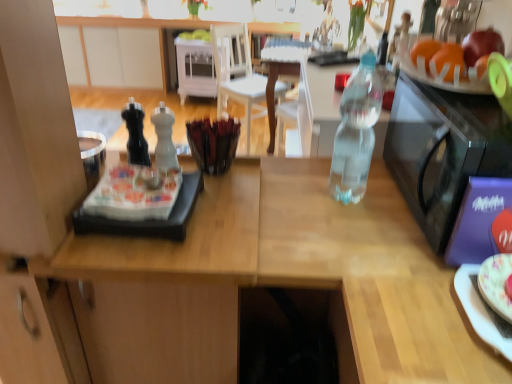
Locate an element on the screen. Image resolution: width=512 pixels, height=384 pixels. vacant point to the left of clear plastic bottle at center, acting as the 1th bottle starting from the right is located at coordinates (278, 190).